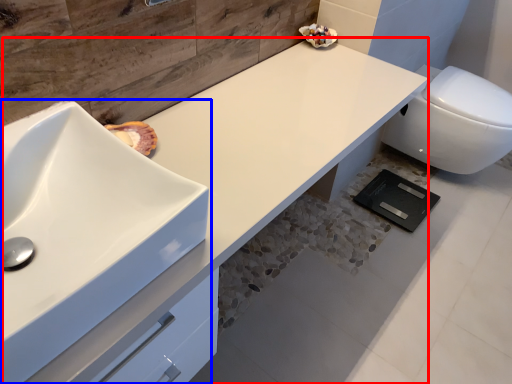
Question: Among these objects, which one is nearest to the camera, counter top (highlighted by a red box) or sink (highlighted by a blue box)?

Choices:
 (A) counter top
 (B) sink

Answer: (B)